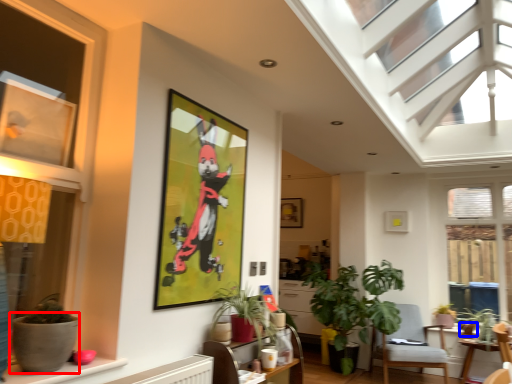
Question: Among these objects, which one is farthest to the camera, flowerpot (highlighted by a red box) or flowerpot (highlighted by a blue box)?

Choices:
 (A) flowerpot
 (B) flowerpot

Answer: (B)